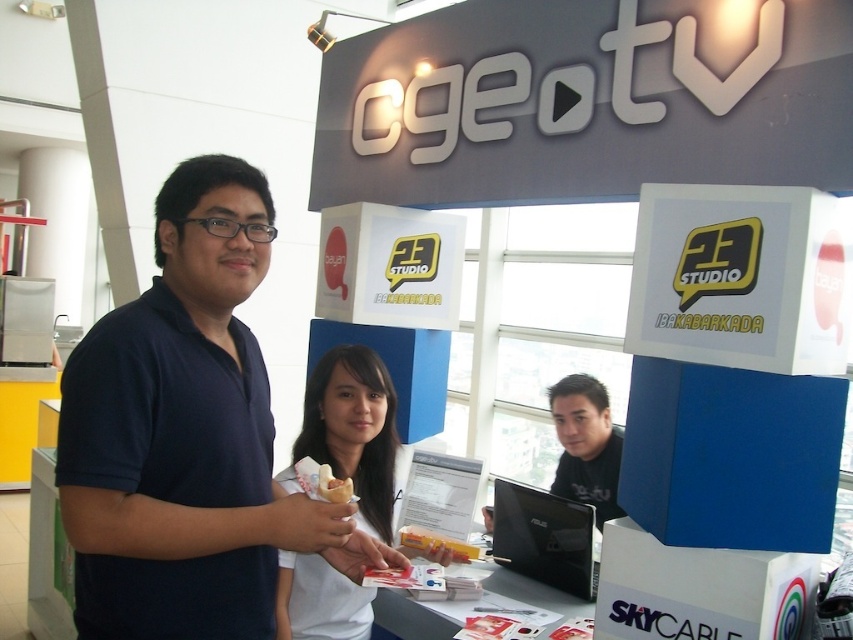
Question: Based on their relative distances, which object is farther from the black matte laptop at center?

Choices:
 (A) white matte ice cream cone at center
 (B) dark blue polo shirt at center
 (C) white matte shirt at center

Answer: (B)

Question: Which point is closer to the camera?

Choices:
 (A) (341, 531)
 (B) (318, 490)
 (C) (590, 422)
 (D) (337, 435)

Answer: (A)

Question: Where is white matte shirt at center located in relation to black matte laptop at center in the image?

Choices:
 (A) right
 (B) left

Answer: (B)

Question: Which point appears closest to the camera in this image?

Choices:
 (A) (366, 426)
 (B) (346, 484)

Answer: (B)

Question: Where is dark blue polo shirt at center located in relation to white matte shirt at center in the image?

Choices:
 (A) right
 (B) left

Answer: (B)

Question: Does white matte shirt at center have a smaller size compared to black matte laptop at center?

Choices:
 (A) no
 (B) yes

Answer: (A)